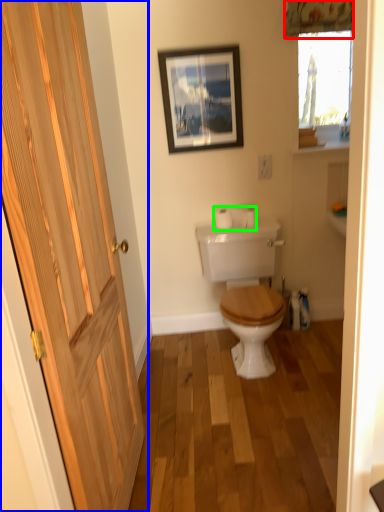
Question: Which object is positioned farthest from curtain (highlighted by a red box)? Select from door (highlighted by a blue box) and toilet paper (highlighted by a green box).

Choices:
 (A) door
 (B) toilet paper

Answer: (A)